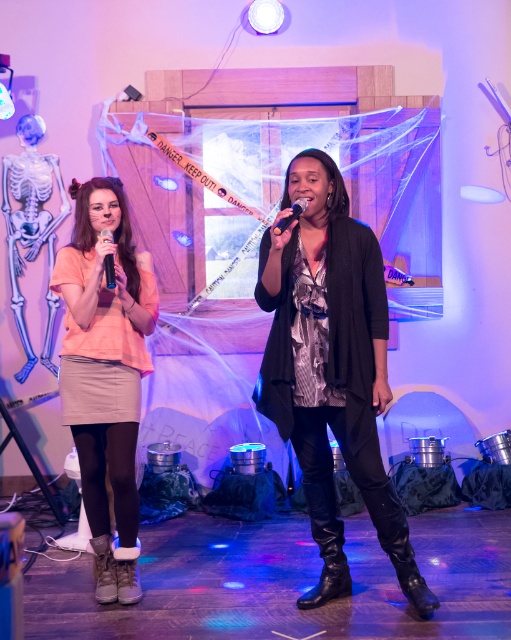
You are standing on the stage and want to move from the matte peach shirt at left to the point marked by coordinates [105,362]. Is that point located on the matte peach shirt at left?

Yes, the point marked by coordinates [105,362] is located on the matte peach shirt at left as per the description.

Both performers are wearing boots. The person on the left has matte black boots at center, and the person on the right has a black leather boot at lower center. Which pair of boots is wider?

The matte black boots at center are wider than the black leather boot at lower center.